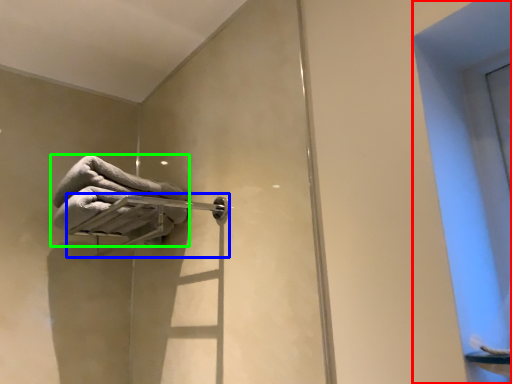
Question: Which is farther away from window (highlighted by a red box)? towel bar (highlighted by a blue box) or towel (highlighted by a green box)?

Choices:
 (A) towel bar
 (B) towel

Answer: (B)